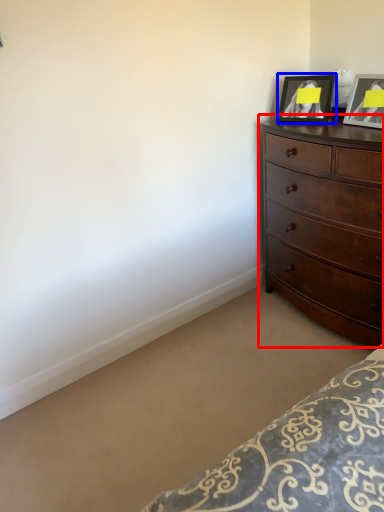
Question: Which of the following is the closest to the observer, chest of drawers (highlighted by a red box) or picture frame (highlighted by a blue box)?

Choices:
 (A) chest of drawers
 (B) picture frame

Answer: (A)